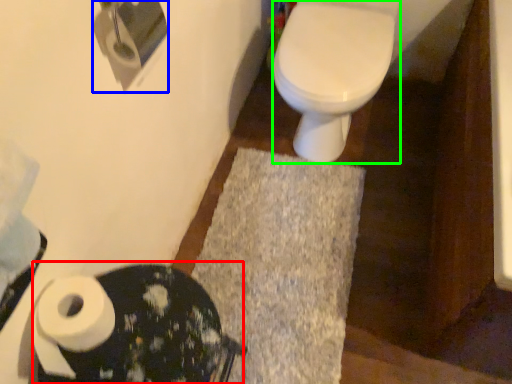
Question: Estimate the real-world distances between objects in this image. Which object is closer to porcelain (highlighted by a red box), toilet paper (highlighted by a blue box) or bidet (highlighted by a green box)?

Choices:
 (A) toilet paper
 (B) bidet

Answer: (A)